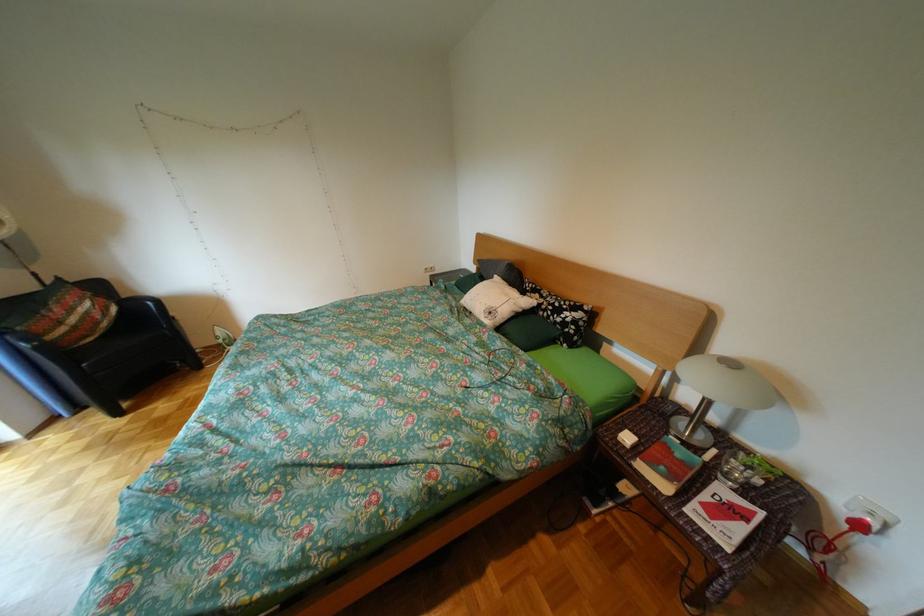
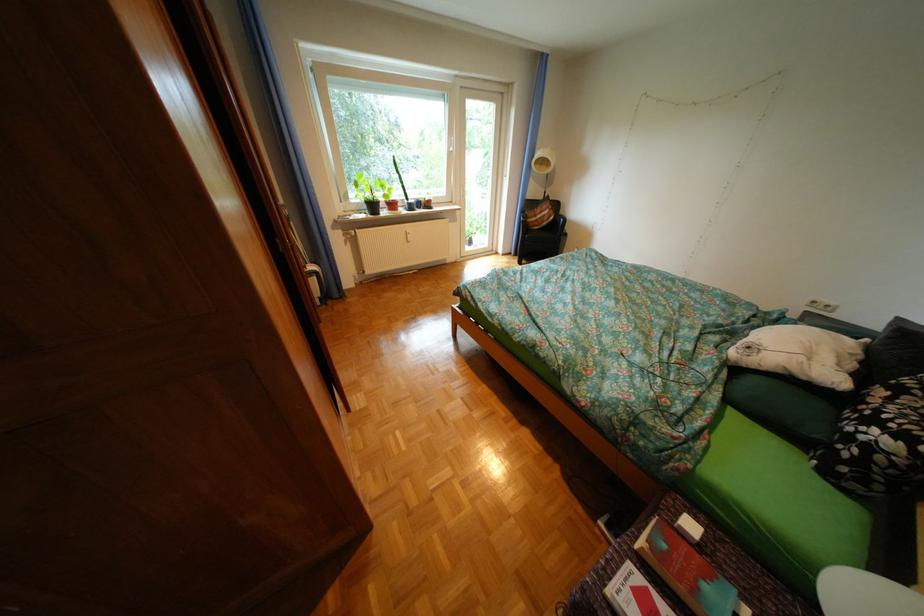
Where in the second image is the point corresponding to [698,496] from the first image?

(658, 565)